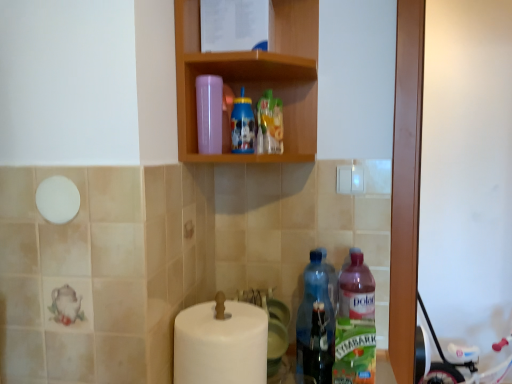
Question: Does white plastic baby carriage at lower right have a larger size compared to white matte toilet paper at lower center?

Choices:
 (A) yes
 (B) no

Answer: (A)

Question: Considering the relative positions of white plastic baby carriage at lower right and white matte toilet paper at lower center in the image provided, is white plastic baby carriage at lower right to the right of white matte toilet paper at lower center from the viewer's perspective?

Choices:
 (A) yes
 (B) no

Answer: (A)

Question: Is white plastic baby carriage at lower right shorter than white matte toilet paper at lower center?

Choices:
 (A) yes
 (B) no

Answer: (B)

Question: From the image's perspective, is white plastic baby carriage at lower right above white matte toilet paper at lower center?

Choices:
 (A) no
 (B) yes

Answer: (A)

Question: From a real-world perspective, is white plastic baby carriage at lower right under white matte toilet paper at lower center?

Choices:
 (A) no
 (B) yes

Answer: (B)

Question: From the image's perspective, is blue plastic bottle at upper center, which appears as the 3th bottle when viewed from the right, above or below white matte toilet paper at lower center?

Choices:
 (A) below
 (B) above

Answer: (B)

Question: Is point (236, 124) positioned closer to the camera than point (236, 382)?

Choices:
 (A) closer
 (B) farther

Answer: (B)

Question: Is blue plastic bottle at upper center, which appears as the 3th bottle when viewed from the right, inside the boundaries of white matte toilet paper at lower center, or outside?

Choices:
 (A) outside
 (B) inside

Answer: (A)

Question: Looking at their shapes, would you say blue plastic bottle at upper center, which appears as the 3th bottle when viewed from the right, is wider or thinner than white matte toilet paper at lower center?

Choices:
 (A) thin
 (B) wide

Answer: (A)

Question: Is polar translucent bottle at lower right, which is counted as the 1th bottle, starting from the right, in front of or behind transparent plastic bottle at lower center, the third bottle when ordered from left to right, in the image?

Choices:
 (A) front
 (B) behind

Answer: (A)

Question: Is polar translucent bottle at lower right, arranged as the fourth bottle when viewed from the left, inside the boundaries of transparent plastic bottle at lower center, the third bottle when ordered from left to right, or outside?

Choices:
 (A) inside
 (B) outside

Answer: (B)

Question: From a real-world perspective, is polar translucent bottle at lower right, arranged as the fourth bottle when viewed from the left, above or below transparent plastic bottle at lower center, the 2th bottle when ordered from right to left?

Choices:
 (A) below
 (B) above

Answer: (A)

Question: In the image, is polar translucent bottle at lower right, arranged as the fourth bottle when viewed from the left, on the left side or the right side of transparent plastic bottle at lower center, the 2th bottle when ordered from right to left?

Choices:
 (A) right
 (B) left

Answer: (A)

Question: Considering the positions of polar translucent bottle at lower right, which is counted as the 1th bottle, starting from the right, and blue plastic bottle at upper center, which appears as the 3th bottle when viewed from the right, in the image, is polar translucent bottle at lower right, which is counted as the 1th bottle, starting from the right, wider or thinner than blue plastic bottle at upper center, which appears as the 3th bottle when viewed from the right,?

Choices:
 (A) wide
 (B) thin

Answer: (A)

Question: From a real-world perspective, is polar translucent bottle at lower right, arranged as the fourth bottle when viewed from the left, positioned above or below blue plastic bottle at upper center, marked as the 2th bottle in a left-to-right arrangement?

Choices:
 (A) above
 (B) below

Answer: (B)